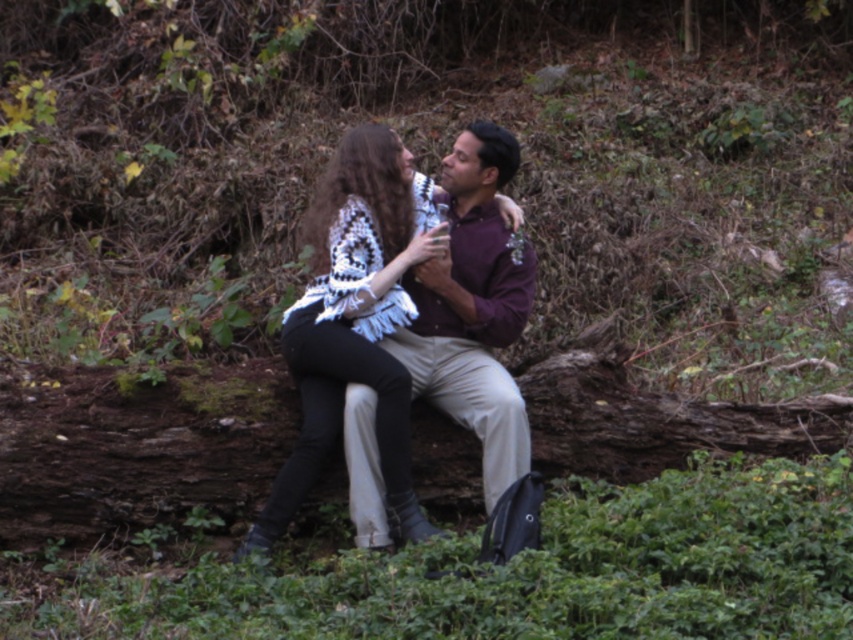
Question: Can you confirm if white crochet sweater at center is thinner than purple matte shirt at center?

Choices:
 (A) no
 (B) yes

Answer: (A)

Question: Which object is closer to the camera taking this photo?

Choices:
 (A) purple matte shirt at center
 (B) white crochet sweater at center

Answer: (B)

Question: Is white crochet sweater at center in front of purple matte shirt at center?

Choices:
 (A) yes
 (B) no

Answer: (A)

Question: Can you confirm if white crochet sweater at center is smaller than purple matte shirt at center?

Choices:
 (A) yes
 (B) no

Answer: (B)